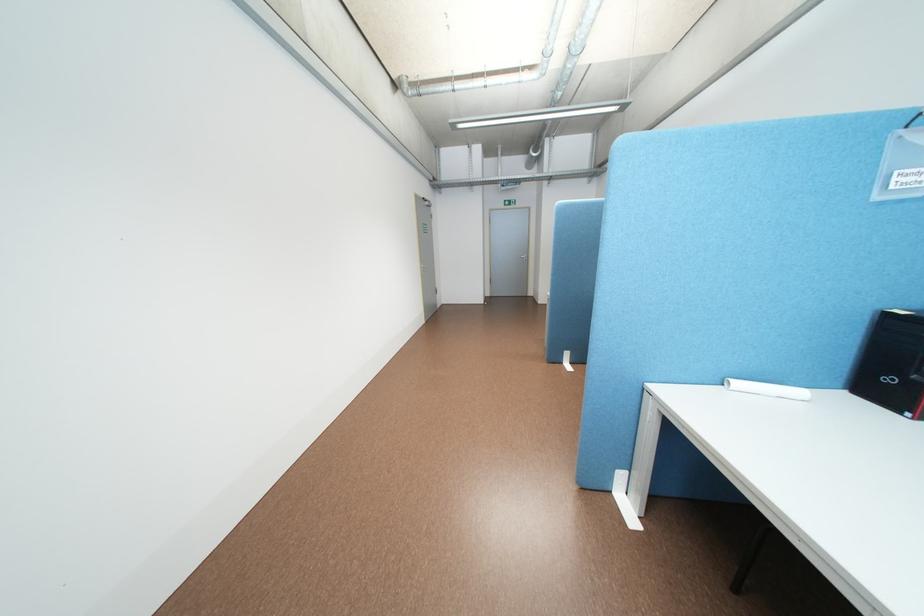
The width and height of the screenshot is (924, 616). In order to click on black computer tower in this screenshot , I will do `click(892, 363)`.